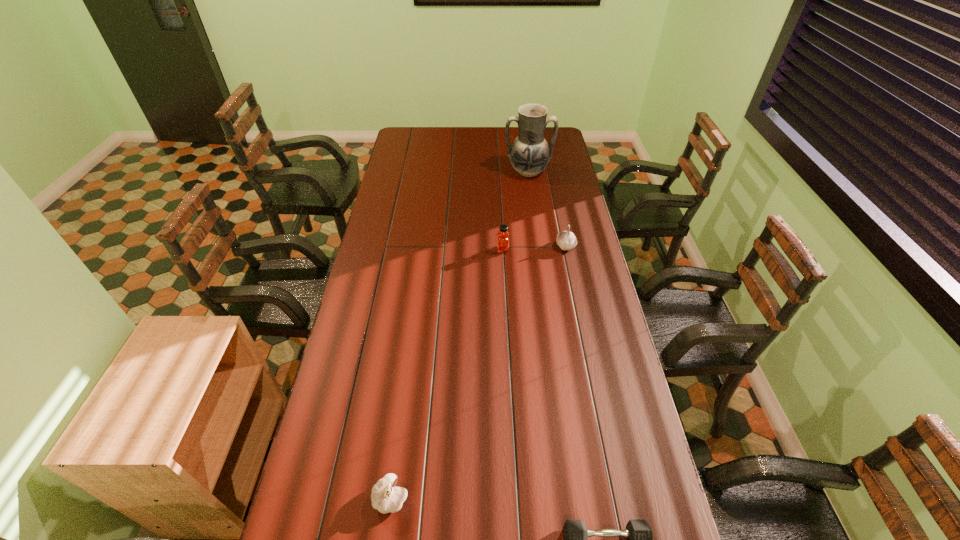
The image size is (960, 540). In order to click on pitcher in this screenshot , I will do `click(529, 154)`.

In order to click on the tallest object in this screenshot , I will do `click(529, 154)`.

You are a GUI agent. You are given a task and a screenshot of the screen. Output one action in this format:
    pyautogui.click(x=<x>, y=<y>)
    Task: Click on the honey
    The height and width of the screenshot is (540, 960).
    Given the screenshot: What is the action you would take?
    pyautogui.click(x=502, y=236)

The image size is (960, 540). In order to click on the farther garlic in this screenshot , I will do `click(566, 240)`.

At what (x,y) coordinates should I click in order to perform the action: click on the left garlic. Please return your answer as a coordinate pair (x, y). This screenshot has width=960, height=540. Looking at the image, I should click on (385, 497).

You are a GUI agent. You are given a task and a screenshot of the screen. Output one action in this format:
    pyautogui.click(x=<x>, y=<y>)
    Task: Click on the second nearest object
    
    Given the screenshot: What is the action you would take?
    pyautogui.click(x=385, y=497)

Locate an element on the screen. Image resolution: width=960 pixels, height=540 pixels. vacant area located on the front-facing side of the farthest object is located at coordinates (533, 202).

Identify the location of vacant region located on the front label of the honey. This screenshot has height=540, width=960. (420, 249).

Where is `free spot located on the front label of the honey`? The height and width of the screenshot is (540, 960). free spot located on the front label of the honey is located at coordinates (420, 249).

This screenshot has height=540, width=960. I want to click on vacant area situated 0.070m on the front label of the honey, so click(478, 249).